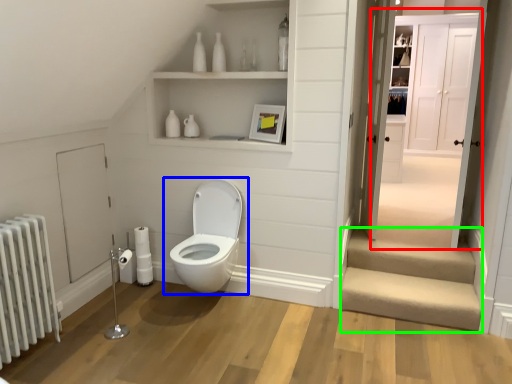
Question: Considering the real-world distances, which object is farthest from door (highlighted by a red box)? toilet (highlighted by a blue box) or stairwell (highlighted by a green box)?

Choices:
 (A) toilet
 (B) stairwell

Answer: (A)